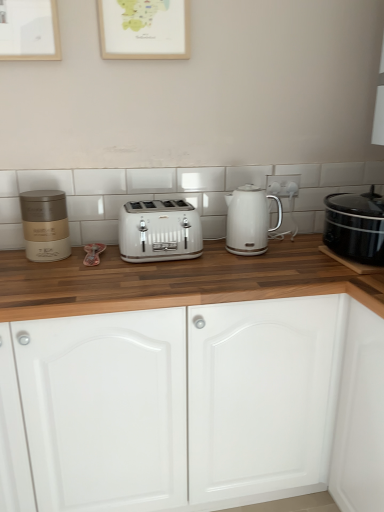
This screenshot has width=384, height=512. In order to click on free space in front of white glossy electric kettle at center in this screenshot , I will do `click(267, 267)`.